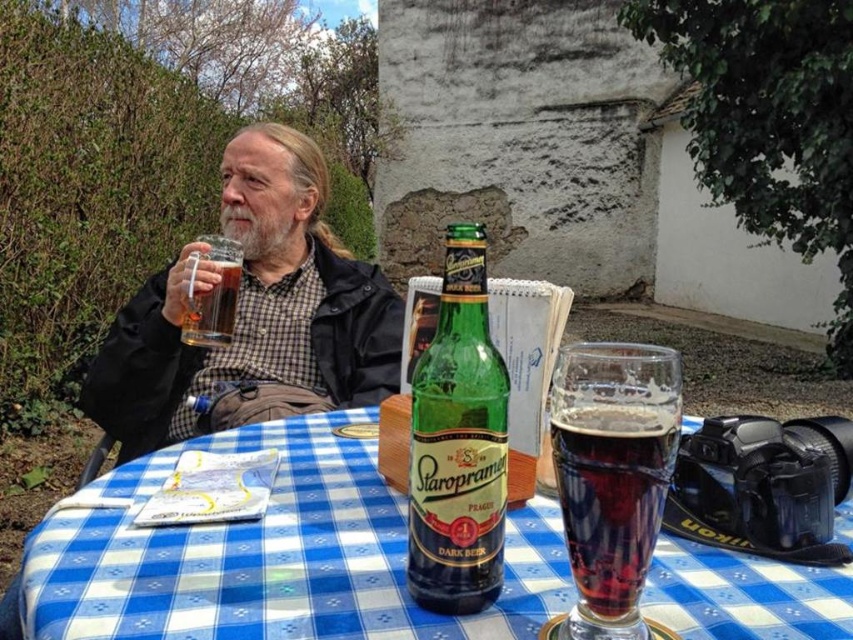
Between matte black jacket at upper left and green glass bottle at center, which one is positioned higher?

Positioned higher is matte black jacket at upper left.

Image resolution: width=853 pixels, height=640 pixels. What do you see at coordinates (253, 314) in the screenshot? I see `matte black jacket at upper left` at bounding box center [253, 314].

Identify the location of matte black jacket at upper left. This screenshot has height=640, width=853. (253, 314).

Between matte black jacket at upper left and translucent glass mug at upper center, which one appears on the right side from the viewer's perspective?

Positioned to the right is matte black jacket at upper left.

Can you confirm if matte black jacket at upper left is positioned above translucent glass mug at upper center?

Yes.

The image size is (853, 640). I want to click on matte black jacket at upper left, so click(x=253, y=314).

Does green glass bottle at center have a lesser height compared to translucent glass mug at upper center?

In fact, green glass bottle at center may be taller than translucent glass mug at upper center.

Is green glass bottle at center further to camera compared to translucent glass mug at upper center?

No, green glass bottle at center is closer to the viewer.

Does point (474, 461) come closer to viewer compared to point (241, 257)?

Yes, point (474, 461) is in front of point (241, 257).

Identify the location of green glass bottle at center. The image size is (853, 640). (457, 442).